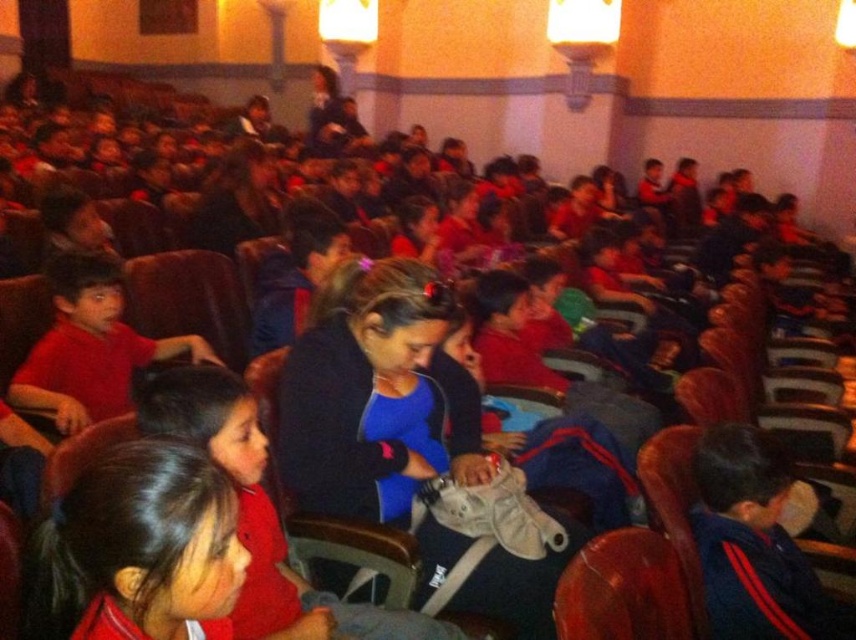
You are standing at the entrance of the auditorium and want to locate the matte red shirt at center. According to the coordinates provided, where should you look to find it?

The matte red shirt at center is located at coordinates point (135, 545), so you should look towards the lower right area of the auditorium.

You are standing at the entrance of the auditorium and see the point marked at coordinates (135, 545). What object is located at that point?

The point at coordinates (135, 545) marks the location of the matte red shirt at center.

You are standing at the entrance of the auditorium and want to locate the matte red shirt at center. According to the coordinates provided, where should you look to find it?

The matte red shirt at center is located at coordinates point (135, 545), which would be towards the lower right area of the auditorium from your entrance perspective.